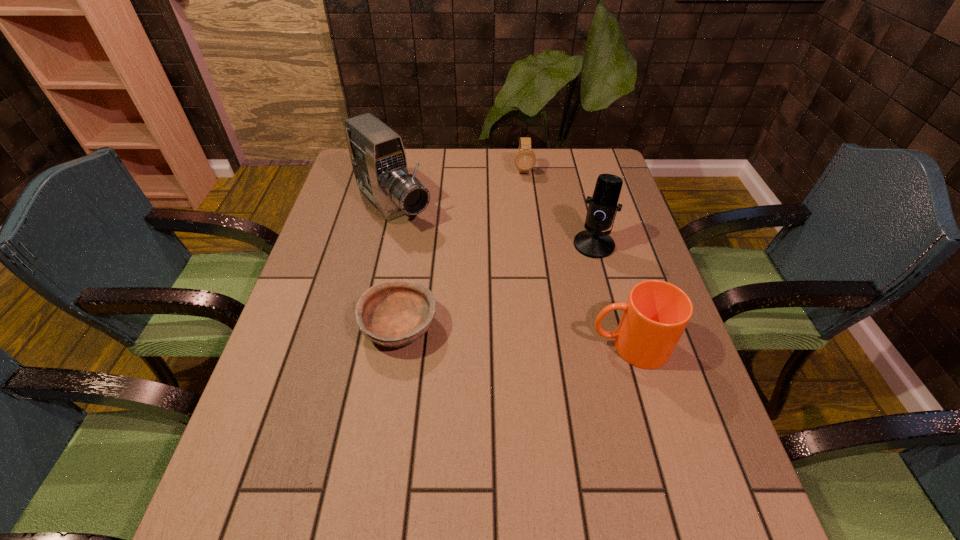
Find the location of a particular element. The height and width of the screenshot is (540, 960). unoccupied area between the shortest object and the second shortest object is located at coordinates (462, 249).

Identify the location of vacant area that lies between the camcorder and the shortest object. The image size is (960, 540). (396, 267).

You are a GUI agent. You are given a task and a screenshot of the screen. Output one action in this format:
    pyautogui.click(x=<x>, y=<y>)
    Task: Click on the empty location between the third shortest object and the fourth tallest object
    The height and width of the screenshot is (540, 960).
    Given the screenshot: What is the action you would take?
    pyautogui.click(x=576, y=258)

Locate an element on the screen. The width and height of the screenshot is (960, 540). vacant area that lies between the mug and the shortest object is located at coordinates (515, 336).

Find the location of a particular element. This screenshot has height=540, width=960. free space between the mug and the watch is located at coordinates (576, 258).

Locate an element on the screen. The width and height of the screenshot is (960, 540). vacant space that is in between the bowl and the second shortest object is located at coordinates 462,249.

At what (x,y) coordinates should I click in order to perform the action: click on unoccupied position between the microphone and the mug. Please return your answer as a coordinate pair (x, y). The height and width of the screenshot is (540, 960). Looking at the image, I should click on (612, 295).

Find the location of a particular element. This screenshot has width=960, height=540. free space between the mug and the shortest object is located at coordinates (515, 336).

Where is `empty space that is in between the watch and the bowl`? The height and width of the screenshot is (540, 960). empty space that is in between the watch and the bowl is located at coordinates (462, 249).

You are a GUI agent. You are given a task and a screenshot of the screen. Output one action in this format:
    pyautogui.click(x=<x>, y=<y>)
    Task: Click on the vacant area that lies between the third object from right to left and the shortest object
    Image resolution: width=960 pixels, height=540 pixels.
    Given the screenshot: What is the action you would take?
    pyautogui.click(x=462, y=249)